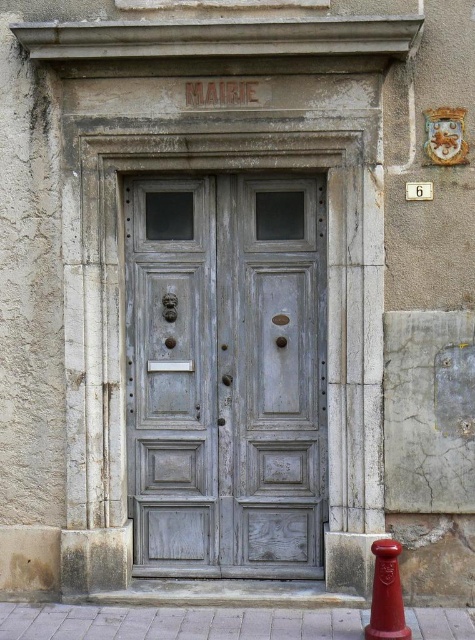
Question: Which object is closer to the camera taking this photo?

Choices:
 (A) weathered wood door at center
 (B) shiny red traffic cone at lower right

Answer: (B)

Question: Is weathered wood door at center to the right of shiny red traffic cone at lower right from the viewer's perspective?

Choices:
 (A) yes
 (B) no

Answer: (B)

Question: Is weathered wood door at center to the left of shiny red traffic cone at lower right from the viewer's perspective?

Choices:
 (A) no
 (B) yes

Answer: (B)

Question: Does weathered wood door at center have a lesser width compared to shiny red traffic cone at lower right?

Choices:
 (A) yes
 (B) no

Answer: (B)